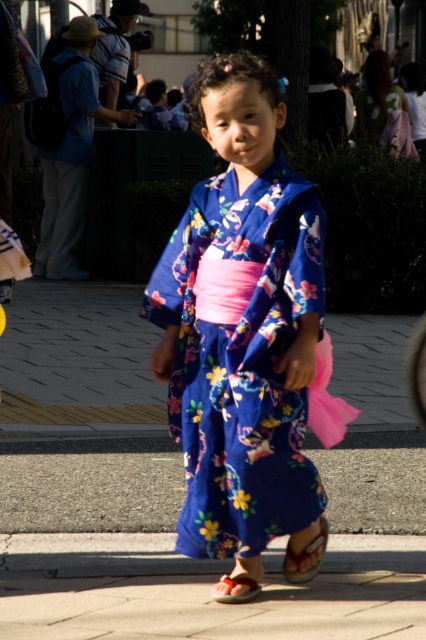
What is the exact 2D coordinate of the floral silk kimono at center in the image?

The exact 2D coordinate of the floral silk kimono at center is at point (241, 326).

You are a photographer trying to capture a closeup of the floral silk kimono at center and the leather sandal at lower center. Since the camera can only focus on one object at a time, which object should you choose to ensure the larger one is in focus?

The floral silk kimono at center is bigger than the leather sandal at lower center, so you should focus on the floral silk kimono at center to ensure the larger object is in focus.

You are a photographer trying to capture the child in the center of the image. The child is wearing a leather sandal at lower center. To ensure the sandal is in the perfect spot for your shot, where should you position the sandal in terms of coordinates?

The leather sandal at lower center is located at coordinates 0.870 on the x axis and 0.718 on the y axis.